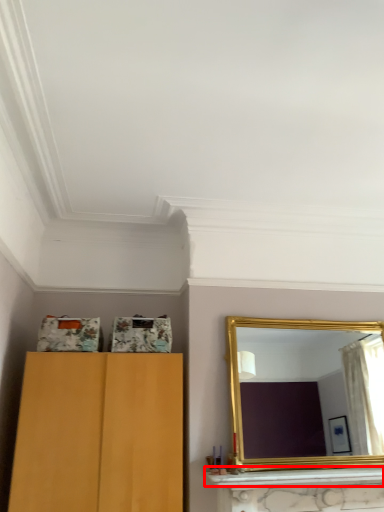
Question: From the image's perspective, what is the correct spatial relationship of mantle (annotated by the red box) in relation to mirror?

Choices:
 (A) below
 (B) above

Answer: (A)